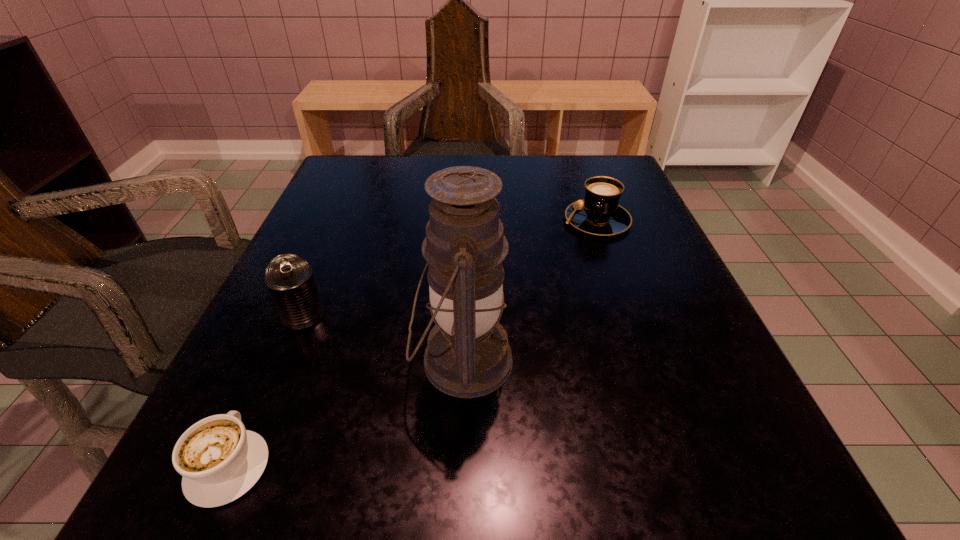
The image size is (960, 540). Find the location of `free spot that satisfies the following two spatial constraints: 1. to the right of the third shortest object's handle; 2. on the left side of the nearer cappuccino`. free spot that satisfies the following two spatial constraints: 1. to the right of the third shortest object's handle; 2. on the left side of the nearer cappuccino is located at coordinates (295, 316).